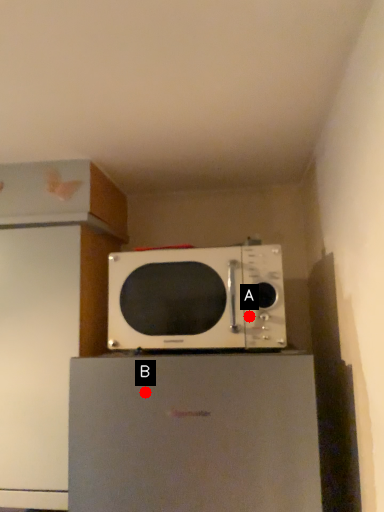
Question: Two points are circled on the image, labeled by A and B beside each circle. Among these points, which one is nearest to the camera?

Choices:
 (A) A is closer
 (B) B is closer

Answer: (B)